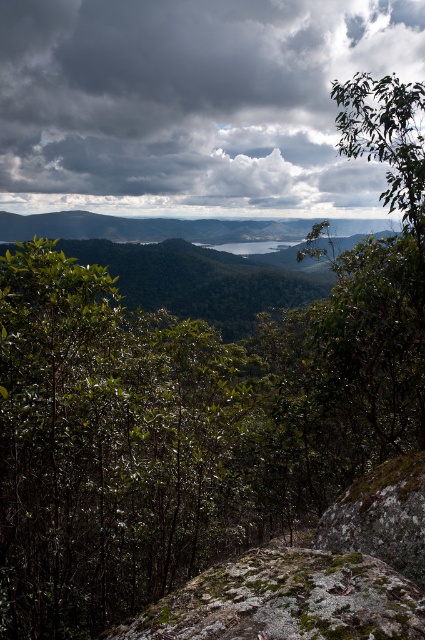
From the picture: Measure the distance between dark gray cloud at upper center and camera.

They are 55.17 meters apart.

Can you confirm if dark gray cloud at upper center is wider than mossy rock at center?

Correct, the width of dark gray cloud at upper center exceeds that of mossy rock at center.

Locate an element on the screen. Image resolution: width=425 pixels, height=640 pixels. dark gray cloud at upper center is located at coordinates (192, 104).

In order to click on dark gray cloud at upper center in this screenshot , I will do `click(192, 104)`.

Can you confirm if dark gray cloud at upper center is positioned to the right of green mossy rock at lower right?

In fact, dark gray cloud at upper center is to the left of green mossy rock at lower right.

Which is behind, point (54, 17) or point (416, 580)?

The point (54, 17) is more distant.

This screenshot has width=425, height=640. What do you see at coordinates (192, 104) in the screenshot?
I see `dark gray cloud at upper center` at bounding box center [192, 104].

Find the location of a particular element. This screenshot has height=640, width=425. dark gray cloud at upper center is located at coordinates click(192, 104).

Between point (190, 605) and point (388, 508), which one is positioned in front?

Point (190, 605) is in front.

Which is below, mossy rock at center or green mossy rock at lower right?

mossy rock at center

This screenshot has width=425, height=640. Identify the location of mossy rock at center. (286, 600).

Where is `mossy rock at center`? Image resolution: width=425 pixels, height=640 pixels. mossy rock at center is located at coordinates (286, 600).